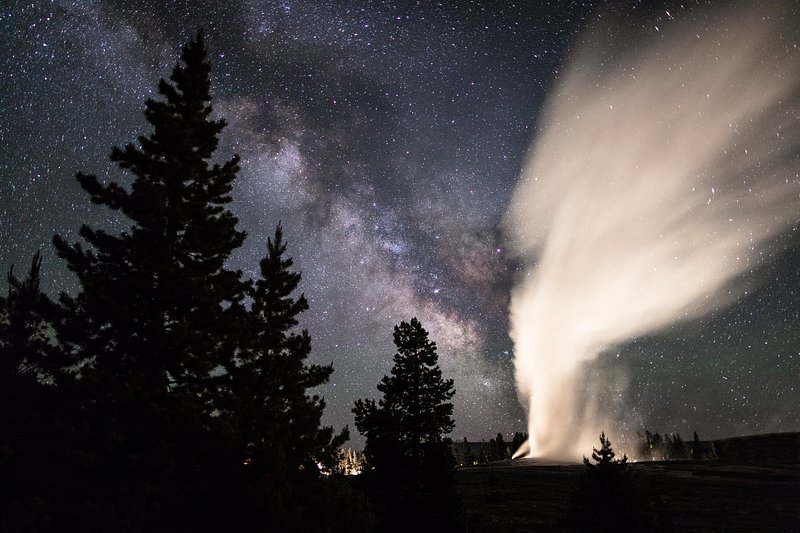
Identify the location of bottom right corner empty space. The height and width of the screenshot is (533, 800). (782, 516).